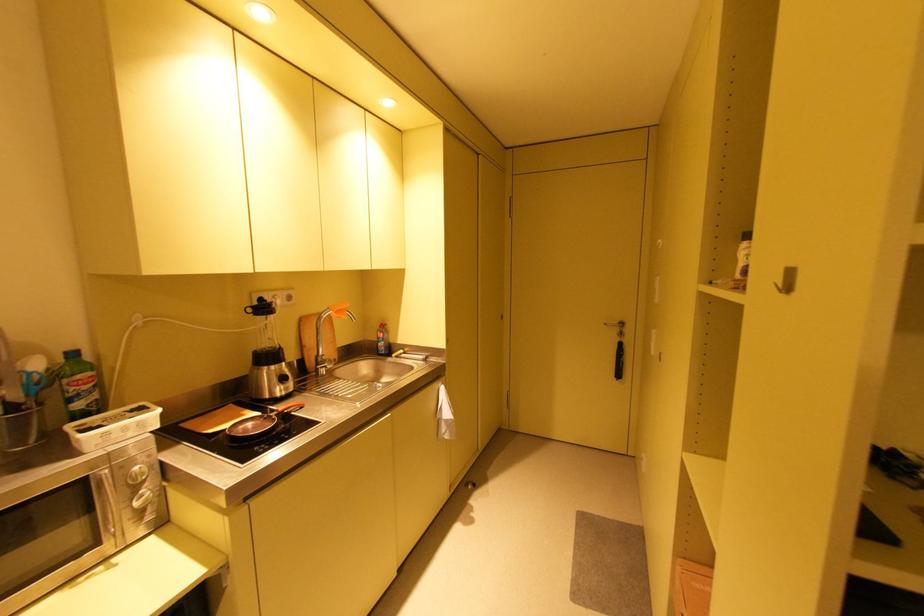
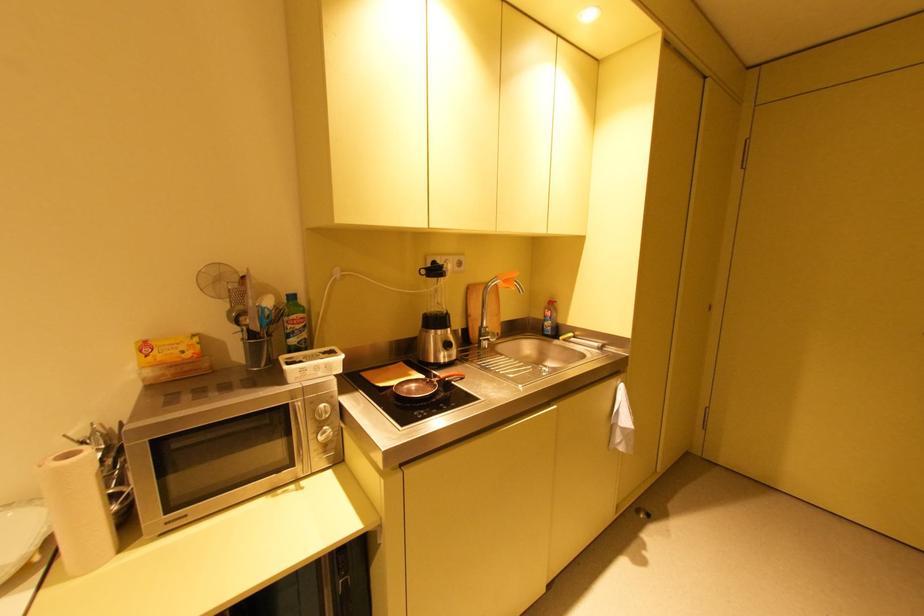
Find the pixel in the second image that matches point (150, 469) in the first image.

(333, 408)